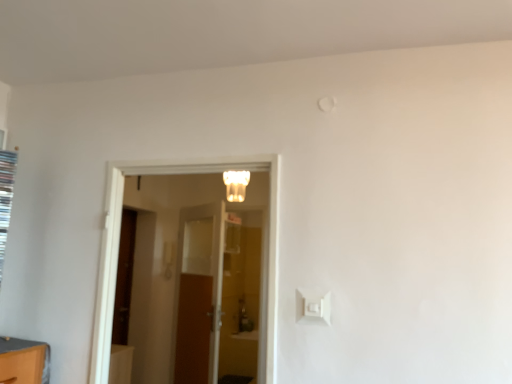
Question: Is white plastic light switch at lower right thinner than white frosted glass light fixture at center?

Choices:
 (A) yes
 (B) no

Answer: (A)

Question: Is white plastic light switch at lower right positioned behind white frosted glass light fixture at center?

Choices:
 (A) yes
 (B) no

Answer: (B)

Question: Is white plastic light switch at lower right next to white frosted glass light fixture at center?

Choices:
 (A) yes
 (B) no

Answer: (B)

Question: Considering the relative sizes of white plastic light switch at lower right and white frosted glass light fixture at center in the image provided, is white plastic light switch at lower right wider than white frosted glass light fixture at center?

Choices:
 (A) yes
 (B) no

Answer: (B)

Question: From a real-world perspective, is white plastic light switch at lower right beneath white frosted glass light fixture at center?

Choices:
 (A) yes
 (B) no

Answer: (A)

Question: From a real-world perspective, is white frosted glass light fixture at center above or below white plastic light switch at lower right?

Choices:
 (A) above
 (B) below

Answer: (A)

Question: Is point (240, 188) positioned closer to the camera than point (309, 306)?

Choices:
 (A) closer
 (B) farther

Answer: (B)

Question: In terms of height, does white frosted glass light fixture at center look taller or shorter compared to white plastic light switch at lower right?

Choices:
 (A) tall
 (B) short

Answer: (A)

Question: Based on their sizes in the image, would you say white frosted glass light fixture at center is bigger or smaller than white plastic light switch at lower right?

Choices:
 (A) big
 (B) small

Answer: (A)

Question: From a real-world perspective, is white glossy door at center, arranged as the 2th door when viewed from the back, above or below white frosted glass light fixture at center?

Choices:
 (A) below
 (B) above

Answer: (A)

Question: From the image's perspective, relative to white frosted glass light fixture at center, is white glossy door at center, arranged as the 2th door when viewed from the back, above or below?

Choices:
 (A) above
 (B) below

Answer: (B)

Question: Is white glossy door at center, placed as the 1th door when sorted from front to back, wider or thinner than white frosted glass light fixture at center?

Choices:
 (A) thin
 (B) wide

Answer: (A)

Question: Does point (274, 187) appear closer or farther from the camera than point (245, 177)?

Choices:
 (A) farther
 (B) closer

Answer: (B)

Question: From the image's perspective, relative to white glossy door at center, placed as the 1th door when sorted from front to back, is wooden door at center, acting as the first door starting from the back, above or below?

Choices:
 (A) above
 (B) below

Answer: (B)

Question: Would you say wooden door at center, acting as the first door starting from the back, is inside or outside white glossy door at center, arranged as the 2th door when viewed from the back?

Choices:
 (A) inside
 (B) outside

Answer: (B)